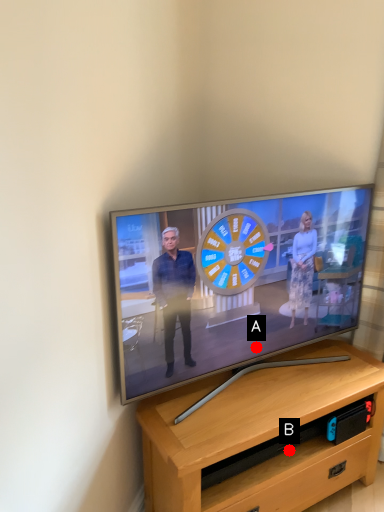
Question: Two points are circled on the image, labeled by A and B beside each circle. Which point is farther from the camera taking this photo?

Choices:
 (A) A is further
 (B) B is further

Answer: (A)